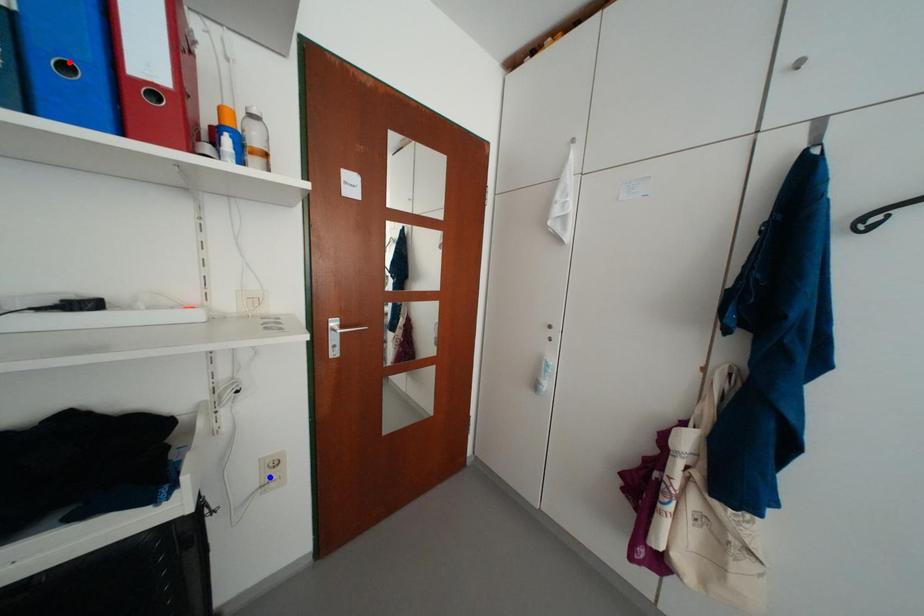
Question: Which of the two points in the image is closer to the camera?

Choices:
 (A) Blue point is closer.
 (B) Red point is closer.

Answer: (B)